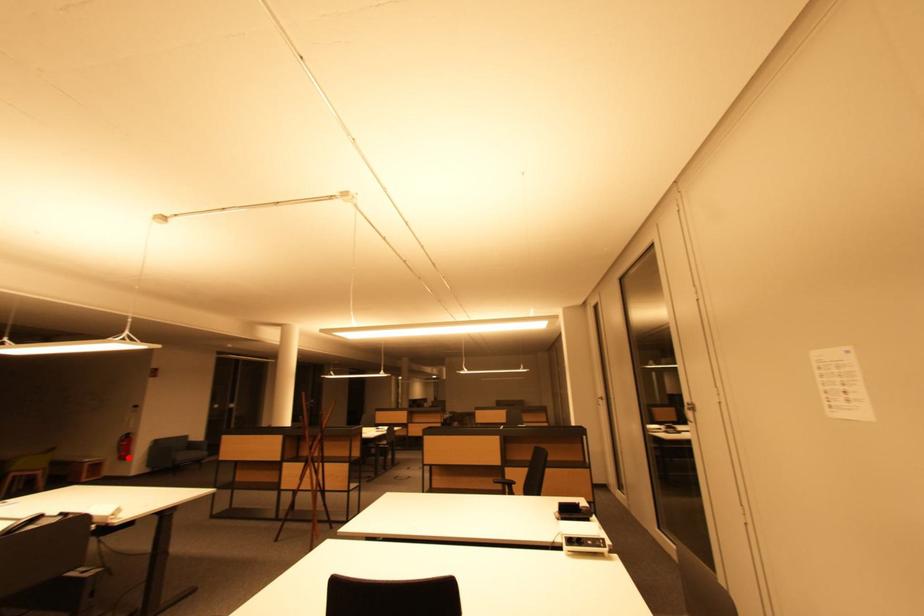
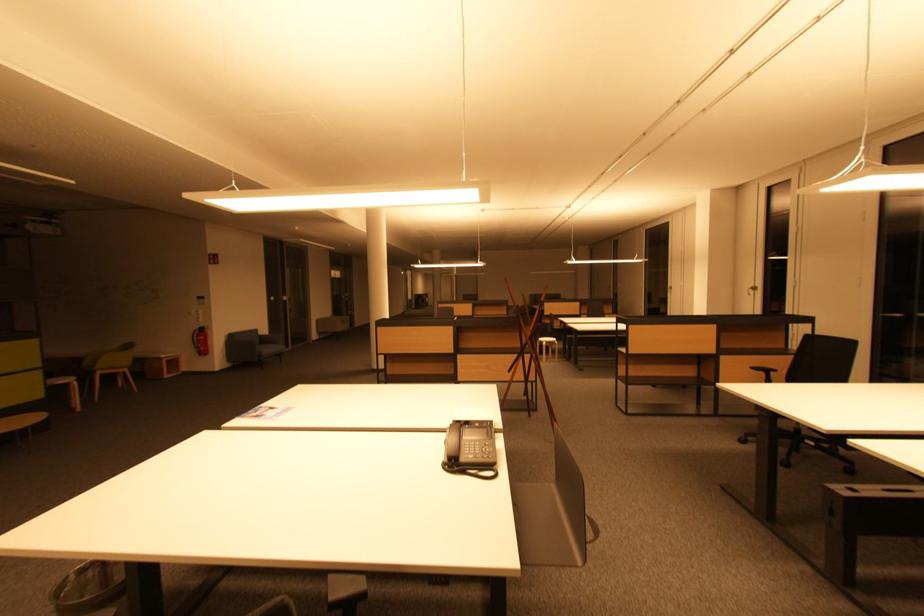
Question: I am providing you with two images of the same scene from different viewpoints. Given a red point in image1, look at the same physical point in image2. Is it:

Choices:
 (A) Closer to the viewpoint
 (B) Farther from the viewpoint

Answer: (B)